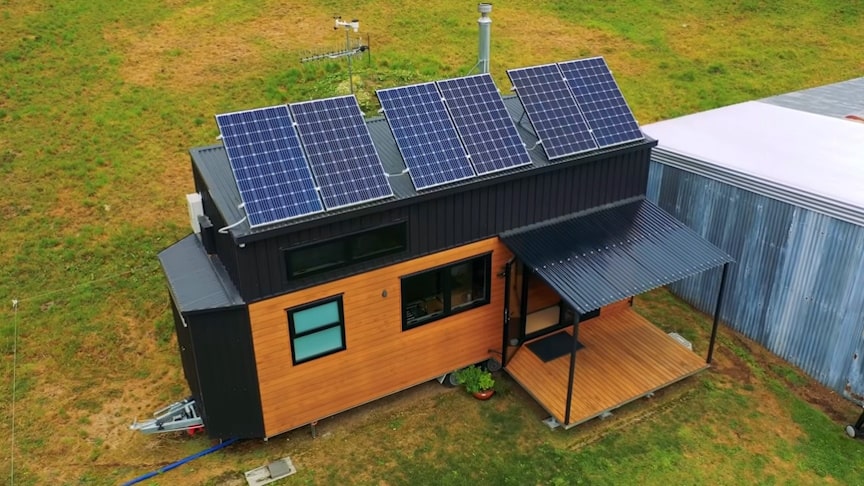
Find the location of a particular element. The height and width of the screenshot is (486, 864). wall is located at coordinates (390, 366).